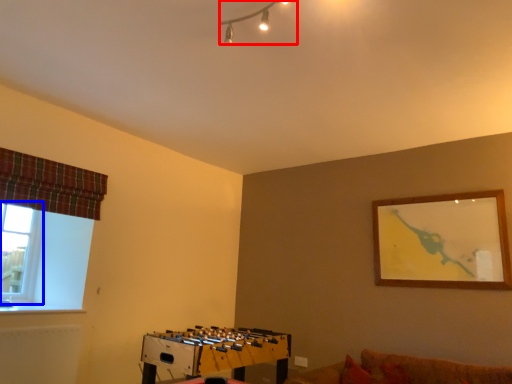
Question: Which object is further to the camera taking this photo, lamp (highlighted by a red box) or window (highlighted by a blue box)?

Choices:
 (A) lamp
 (B) window

Answer: (B)